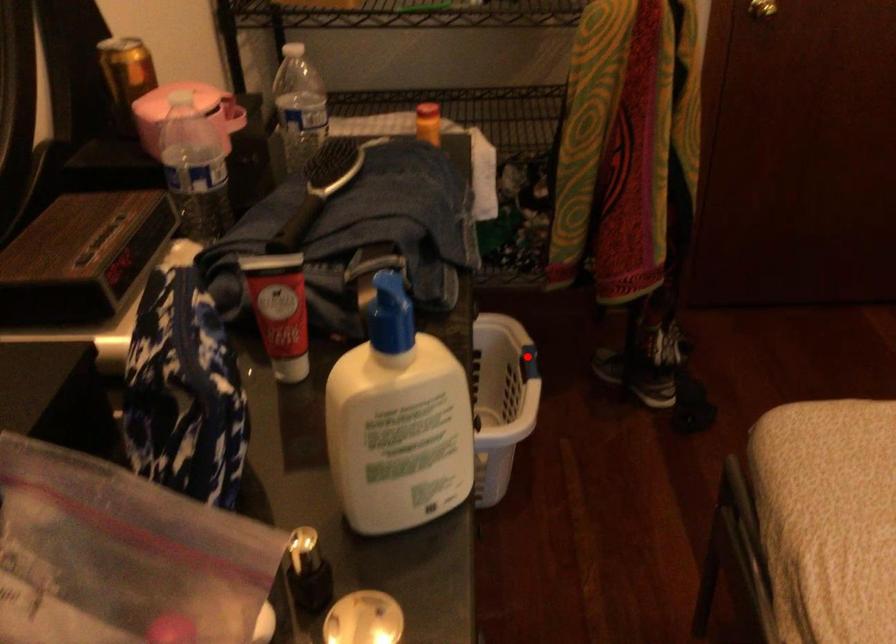
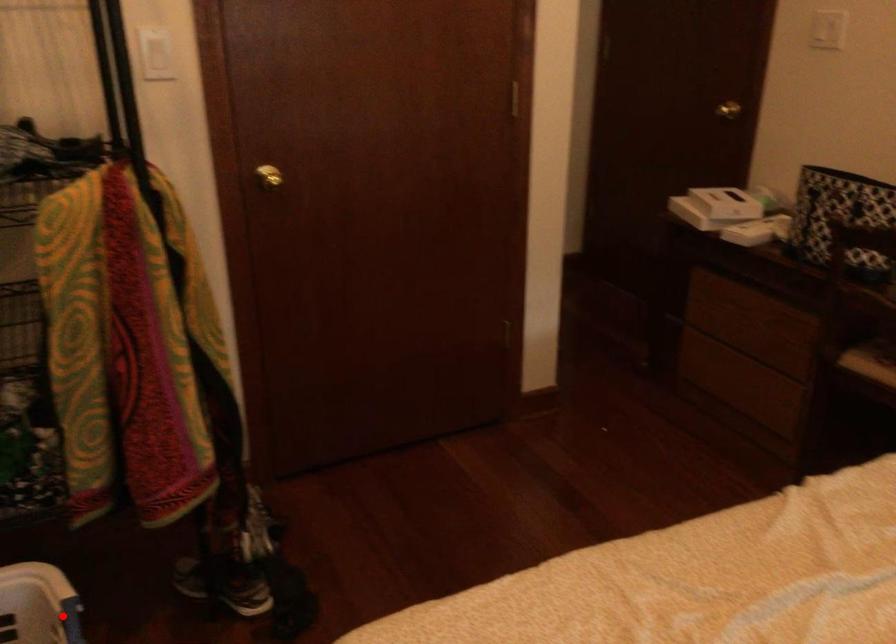
I am providing you with two images of the same scene from different viewpoints. A red point is marked on the first image and another point is marked on the second image. Does the point marked in image1 correspond to the same location as the one in image2?

Yes